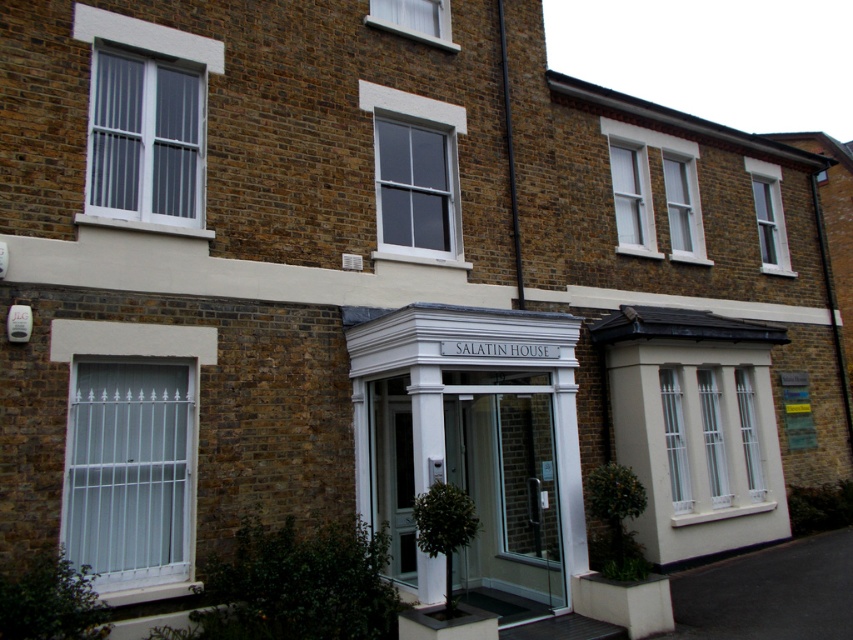
You are standing in front of the Salatin House and want to enter through the transparent glass door at center. Which side of the white glossy pillar at center should you walk around to reach the door?

The transparent glass door at center is to the right of the white glossy pillar at center, so you should walk around the right side of the white glossy pillar at center to reach the door.